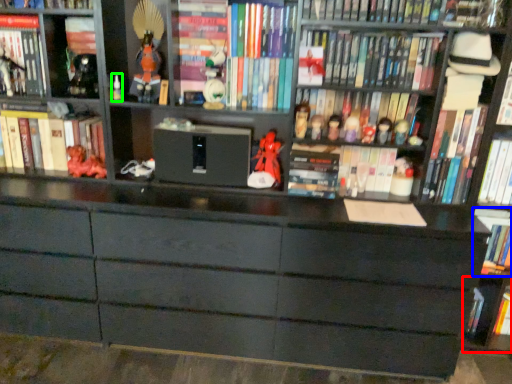
Question: Which object is positioned farthest from cabinet (highlighted by a red box)? Select from book (highlighted by a blue box) and toy (highlighted by a green box).

Choices:
 (A) book
 (B) toy

Answer: (B)